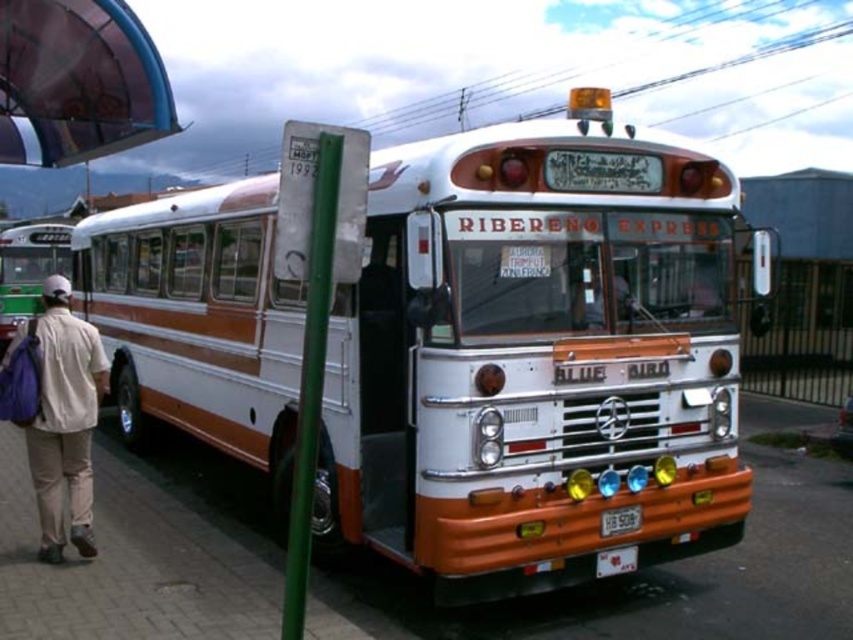
Who is more forward, (297, 291) or (294, 586)?

Positioned in front is point (294, 586).

Is point (648, 323) positioned behind point (289, 584)?

Yes, point (648, 323) is behind point (289, 584).

The image size is (853, 640). Describe the element at coordinates (535, 358) in the screenshot. I see `white/orange metal bus at center` at that location.

The height and width of the screenshot is (640, 853). Identify the location of white/orange metal bus at center. (535, 358).

Does white/orange metal bus at center come in front of brick pavement at lower left?

Yes, white/orange metal bus at center is in front of brick pavement at lower left.

The image size is (853, 640). Identify the location of white/orange metal bus at center. (535, 358).

Is brick pavement at lower left bigger than white plastic license plate at center?

Yes, brick pavement at lower left is bigger than white plastic license plate at center.

Can you confirm if brick pavement at lower left is wider than white plastic license plate at center?

Indeed, brick pavement at lower left has a greater width compared to white plastic license plate at center.

The height and width of the screenshot is (640, 853). Describe the element at coordinates (653, 580) in the screenshot. I see `brick pavement at lower left` at that location.

Where is `brick pavement at lower left`? brick pavement at lower left is located at coordinates (653, 580).